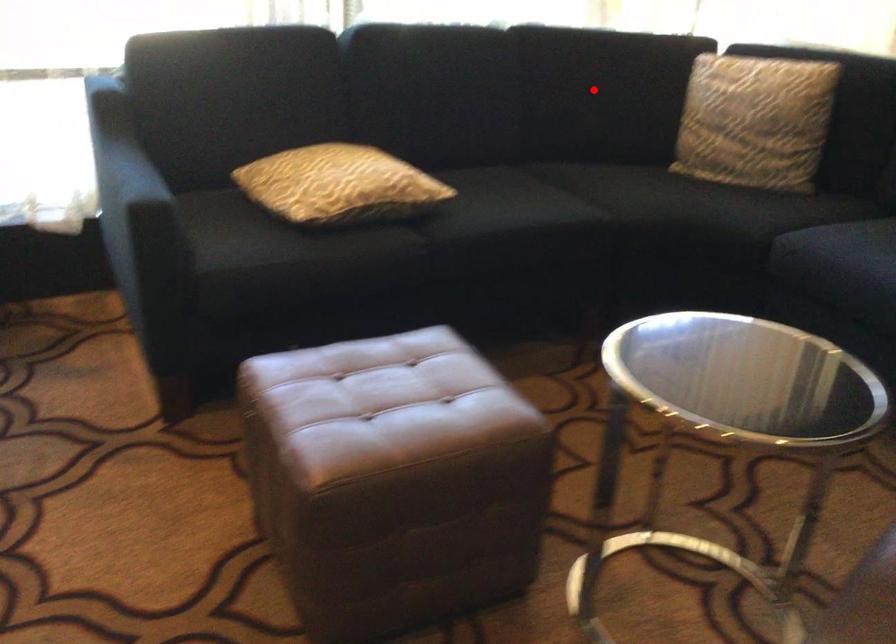
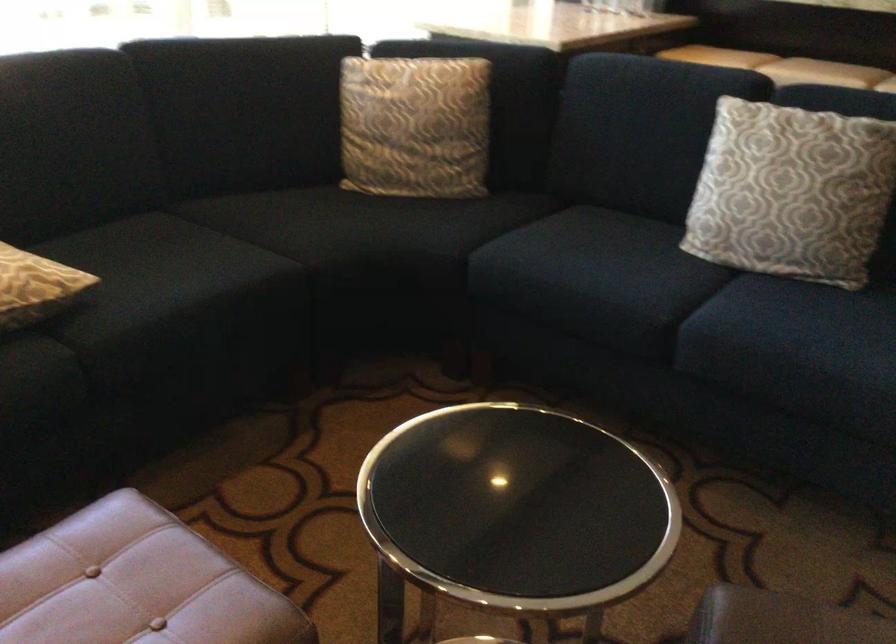
Locate, in the second image, the point that corresponds to the highlighted location in the first image.

(238, 111)